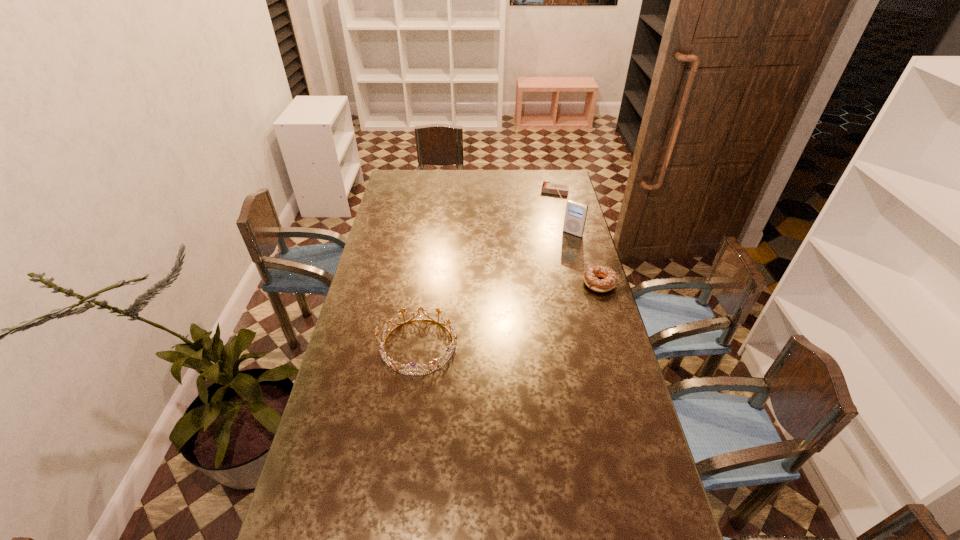
Where is `tiara`? This screenshot has width=960, height=540. tiara is located at coordinates (392, 364).

Find the location of `the third shortest object`. the third shortest object is located at coordinates tap(392, 364).

The width and height of the screenshot is (960, 540). I want to click on the third tallest object, so click(609, 282).

Identify the location of doughnut. (609, 282).

Find the location of a particular element. the tallest object is located at coordinates (575, 215).

Find the location of a particular element. iPod is located at coordinates (575, 215).

This screenshot has height=540, width=960. What are the coordinates of `matchbox` in the screenshot? It's located at tap(547, 187).

What are the coordinates of `the farthest object` in the screenshot? It's located at (547, 187).

Find the location of a particular element. free space located 0.120m on the front-facing side of the nearest object is located at coordinates pos(344,346).

You are a GUI agent. You are given a task and a screenshot of the screen. Output one action in this format:
    pyautogui.click(x=<x>, y=<y>)
    Task: Click on the vacant space situated on the front-facing side of the nearest object
    The height and width of the screenshot is (540, 960).
    Given the screenshot: What is the action you would take?
    pyautogui.click(x=364, y=346)